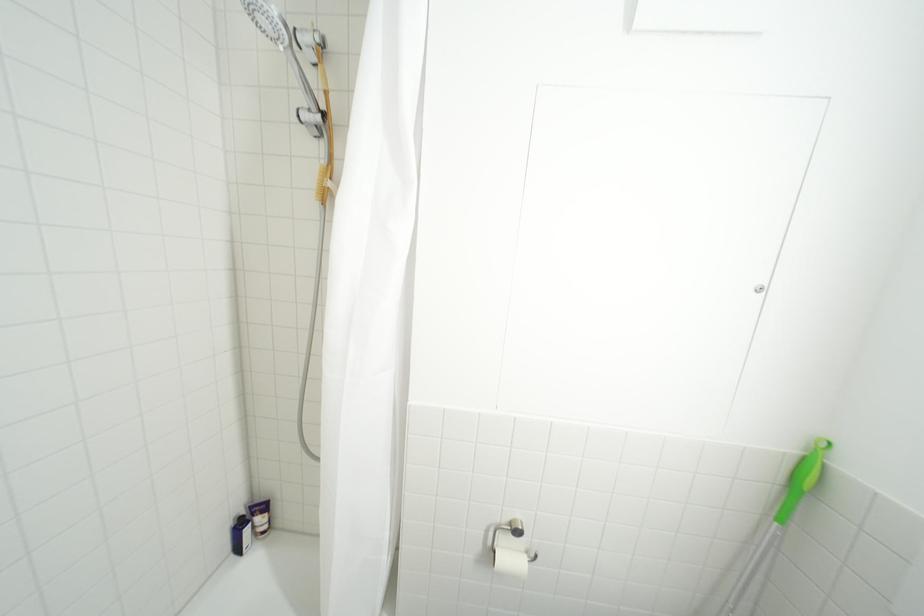
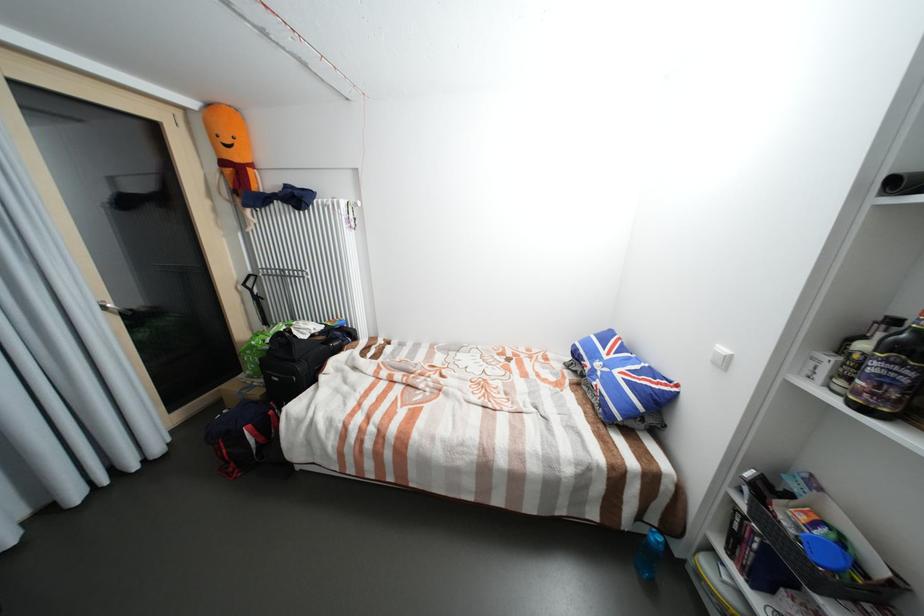
What movement of the cameraman would produce the second image?

The cameraman moved toward left, backward.